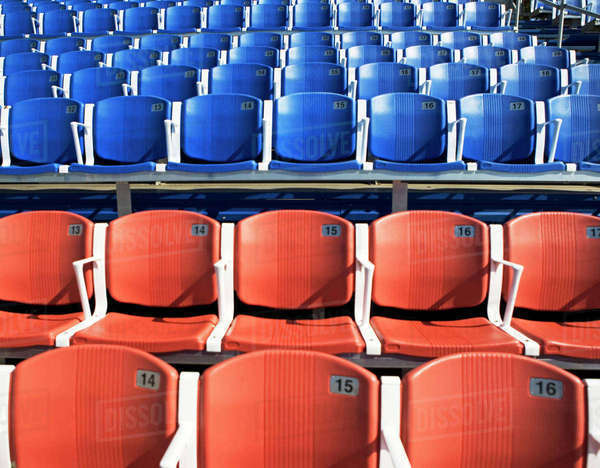
Find the location of a particular element. blue seats in the front row is located at coordinates point(52,132), point(139,134), point(220,125), point(297,125), point(423,122), point(516,123), point(572,124).